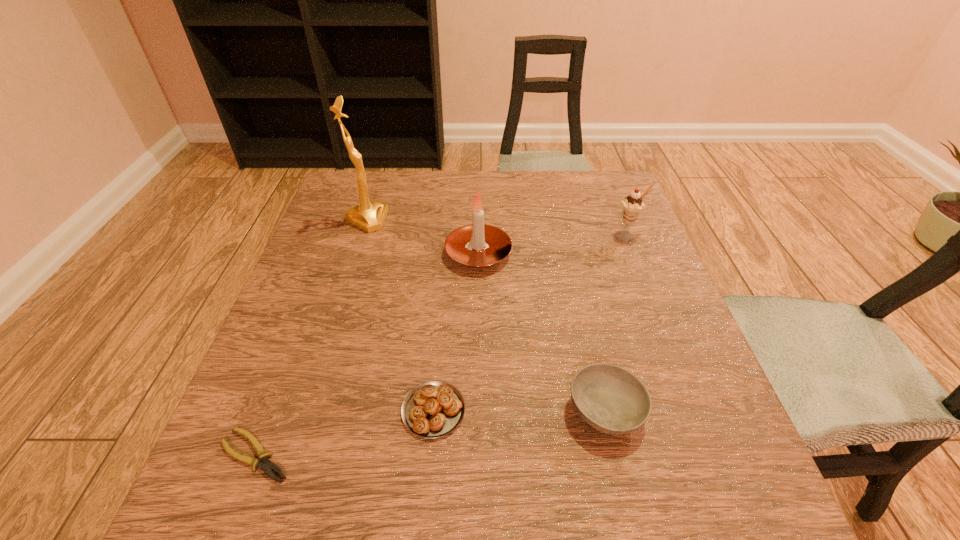
At what (x,y) coordinates should I click in order to perform the action: click on vacant region between the rightmost object and the tallest object. Please return your answer as a coordinate pair (x, y). This screenshot has height=540, width=960. Looking at the image, I should click on (497, 228).

Identify the location of vacant region between the icecream and the award. This screenshot has height=540, width=960. (497, 228).

Identify the location of free space between the pliers and the award. This screenshot has width=960, height=540. (311, 338).

This screenshot has height=540, width=960. What are the coordinates of `free space between the fifth tallest object and the fourth tallest object` in the screenshot? It's located at (519, 410).

You are a GUI agent. You are given a task and a screenshot of the screen. Output one action in this format:
    pyautogui.click(x=<x>, y=<y>)
    Task: Click on the unoccupied position between the tallest object and the candle
    This screenshot has height=540, width=960.
    Given the screenshot: What is the action you would take?
    pyautogui.click(x=422, y=237)

The height and width of the screenshot is (540, 960). Identify the location of free space between the rightmost object and the award. (497, 228).

At what (x,y) coordinates should I click in order to perform the action: click on free space between the award and the second shortest object. Please return your answer as a coordinate pair (x, y). This screenshot has width=960, height=540. Looking at the image, I should click on (400, 315).

Locate an element on the screen. This screenshot has width=960, height=540. vacant area that lies between the candle and the rightmost object is located at coordinates (553, 245).

Locate an element on the screen. object that is the fourth closest to the pastry is located at coordinates (369, 216).

Select which object appears as the fifth closest to the icecream. Please provide its 2D coordinates. Your answer should be formatted as a tuple, i.e. [(x, y)], where the tuple contains the x and y coordinates of a point satisfying the conditions above.

[(267, 466)]